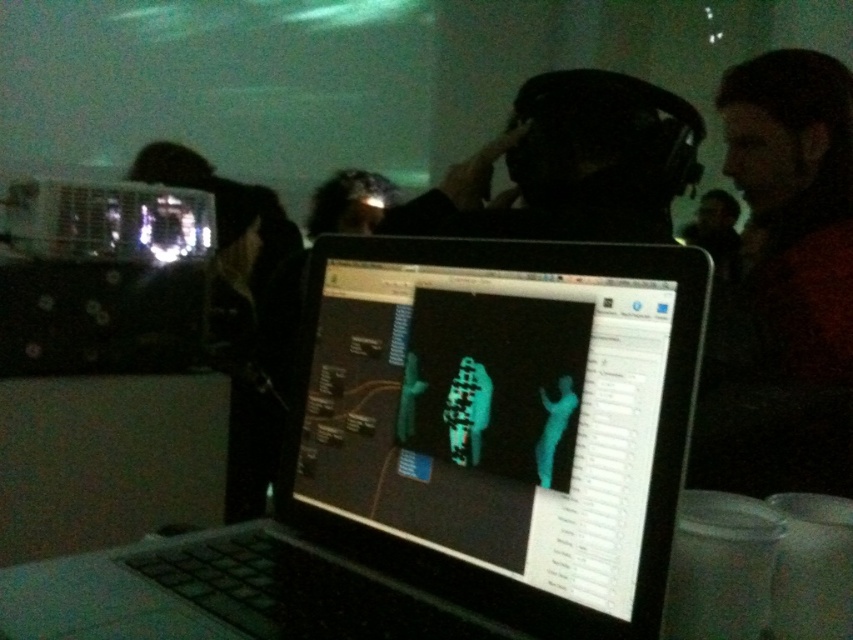
Who is higher up, black plastic laptop at center or black matte headphones at center?

Positioned higher is black matte headphones at center.

Which is in front, point (619, 592) or point (410, 220)?

Positioned in front is point (619, 592).

You are a GUI agent. You are given a task and a screenshot of the screen. Output one action in this format:
    pyautogui.click(x=<x>, y=<y>)
    Task: Click on the black plastic laptop at center
    Image resolution: width=853 pixels, height=640 pixels.
    Given the screenshot: What is the action you would take?
    pyautogui.click(x=438, y=460)